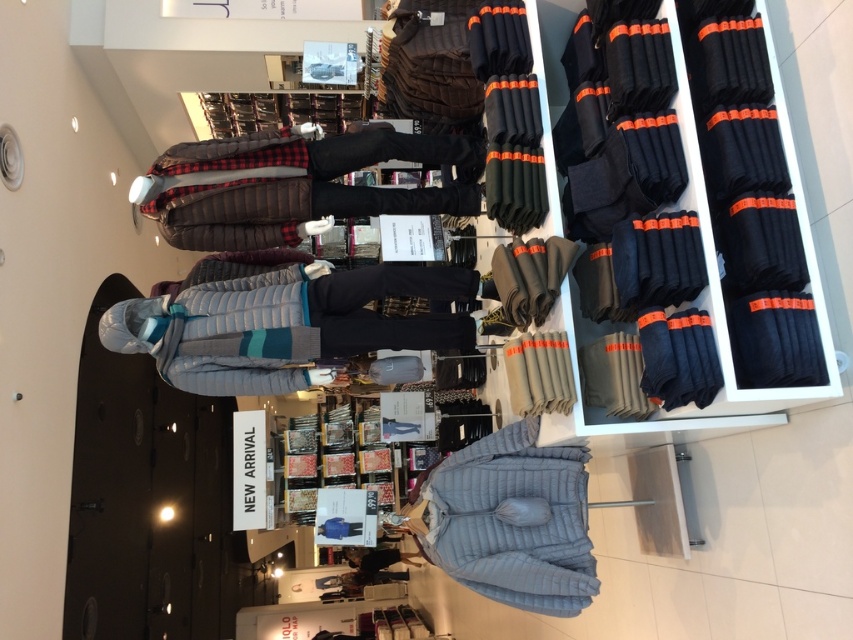
Question: Considering the relative positions of light gray quilted jacket at center and brown quilted jacket at center in the image provided, where is light gray quilted jacket at center located with respect to brown quilted jacket at center?

Choices:
 (A) above
 (B) below

Answer: (B)

Question: Based on their relative distances, which object is nearer to the brown quilted jacket at center?

Choices:
 (A) light gray quilted jacket at center
 (B) dark gray fleece pants at center

Answer: (A)

Question: Is light gray quilted jacket at center above light blue quilted jacket at center?

Choices:
 (A) no
 (B) yes

Answer: (B)

Question: Which of these objects is positioned farthest from the light gray quilted jacket at center?

Choices:
 (A) dark gray fleece pants at center
 (B) brown quilted jacket at center
 (C) light blue quilted jacket at center

Answer: (C)

Question: Which point is closer to the camera?

Choices:
 (A) light gray quilted jacket at center
 (B) light blue quilted jacket at center
 (C) dark gray fleece pants at center
 (D) brown quilted jacket at center

Answer: (C)

Question: Does light gray quilted jacket at center have a lesser width compared to light blue quilted jacket at center?

Choices:
 (A) no
 (B) yes

Answer: (A)